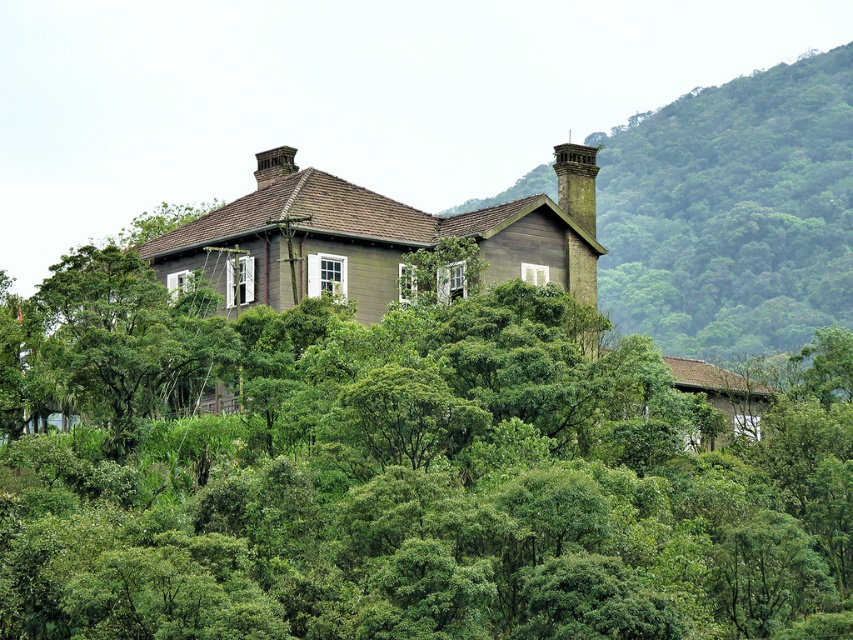
You are standing in front of the house and want to plant a new tree exactly where the green leafy tree at center is currently located. Can you determine the exact coordinates where you should plant the new tree?

The green leafy tree at center should be planted at the coordinates point (440, 490).

You are a painter planning to sketch this house. You want to ensure that the green leafy tree at center and the rustic stone chimney at upper right are proportionally accurate. Which object should you draw wider in your sketch?

The green leafy tree at center should be drawn wider in the sketch since its width is larger than the rustic stone chimney at upper right.